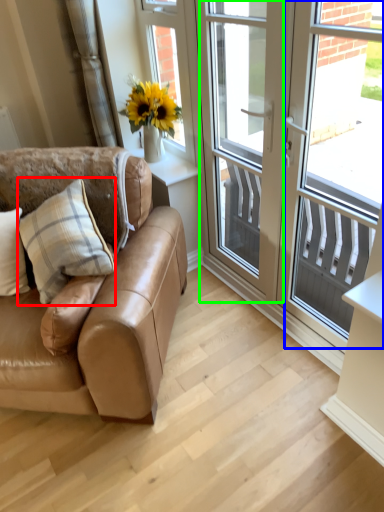
Question: Which object is positioned closest to pillow (highlighted by a red box)? Select from window screen (highlighted by a blue box) and screen door (highlighted by a green box).

Choices:
 (A) window screen
 (B) screen door

Answer: (B)